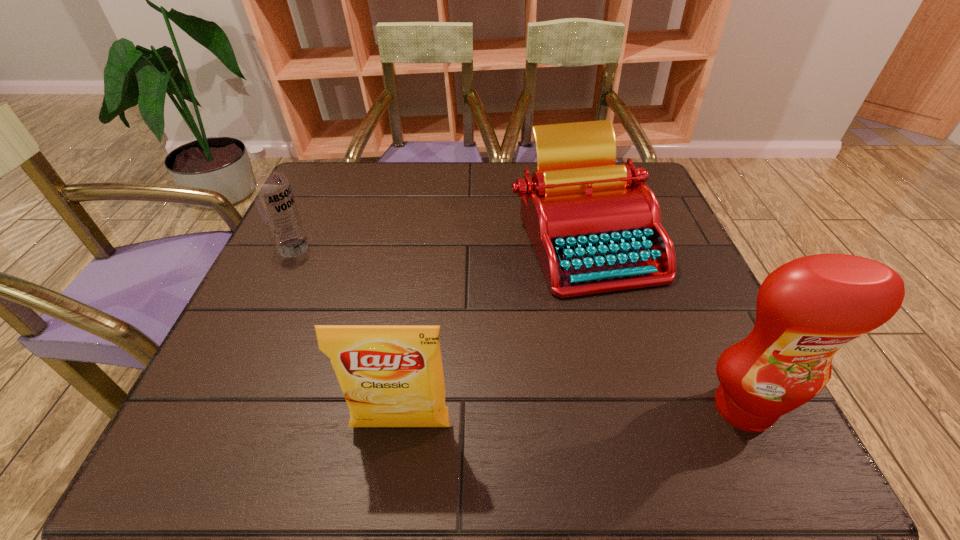
Locate an element on the screen. Image resolution: width=960 pixels, height=540 pixels. free location at the left edge is located at coordinates (309, 238).

Identify the location of vacant space at the right edge of the desktop. (668, 340).

The image size is (960, 540). Identify the location of unoccupied area between the condiment and the shortest object. (662, 322).

At what (x,y) coordinates should I click in order to perform the action: click on vacant space in between the tallest object and the crisp (potato chip). Please return your answer as a coordinate pair (x, y). Image resolution: width=960 pixels, height=540 pixels. Looking at the image, I should click on (572, 417).

The width and height of the screenshot is (960, 540). I want to click on empty space that is in between the tallest object and the second object from left to right, so click(x=572, y=417).

Locate an element on the screen. Image resolution: width=960 pixels, height=540 pixels. free area in between the shortest object and the second object from left to right is located at coordinates (492, 332).

Where is `unoccupied area between the leftmost object and the typewriter`? The image size is (960, 540). unoccupied area between the leftmost object and the typewriter is located at coordinates (438, 242).

Find the location of a particular element. The height and width of the screenshot is (540, 960). empty space between the typewriter and the third object from right to left is located at coordinates (492, 332).

You are a GUI agent. You are given a task and a screenshot of the screen. Output one action in this format:
    pyautogui.click(x=<x>, y=<y>)
    Task: Click on the free space between the vodka and the tallest object
    Image resolution: width=960 pixels, height=540 pixels.
    Given the screenshot: What is the action you would take?
    pyautogui.click(x=517, y=328)

The image size is (960, 540). What are the coordinates of `free space between the shortest object and the leftmost object` in the screenshot? It's located at (438, 242).